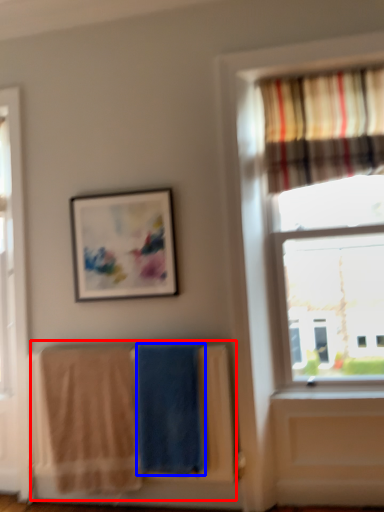
Question: Which point is closer to the camera, laundry (highlighted by a red box) or beach towel (highlighted by a blue box)?

Choices:
 (A) laundry
 (B) beach towel

Answer: (A)